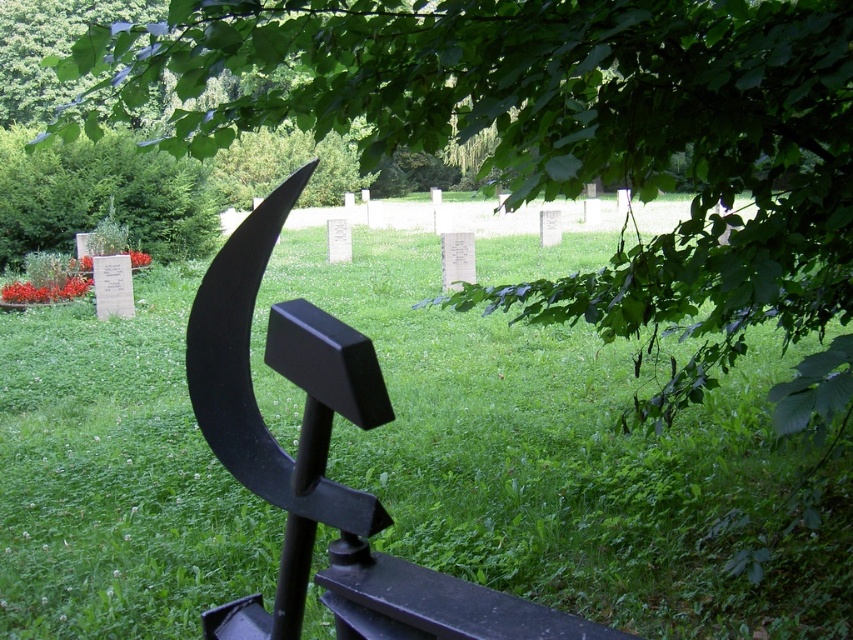
You are a gardener who needs to mow the lawn. Based on the image, which area should you prioritize first, the green grass at center or the green leafy tree at upper left, considering their height?

The green grass at center is taller than the green leafy tree at upper left, so you should prioritize mowing the green grass at center first.

You are standing at the edge of the cemetery and want to place a new headstone at the exact center of the green grass at center. According to the coordinates provided, where should you place the headstone?

The green grass at center is located at coordinates point (563, 458), so you should place the headstone at that exact point to ensure it is centered.